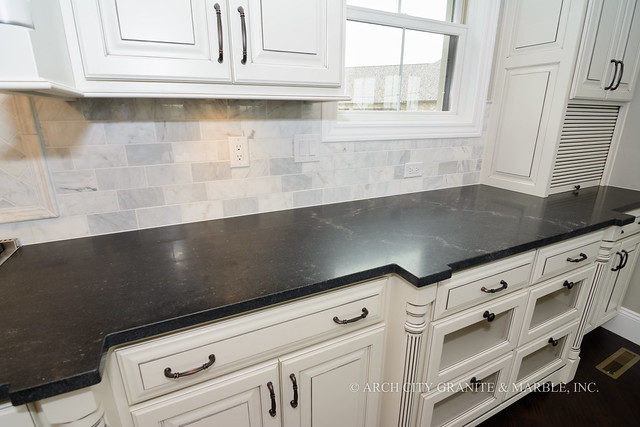
Identify the location of dark brown floor. (569, 407).